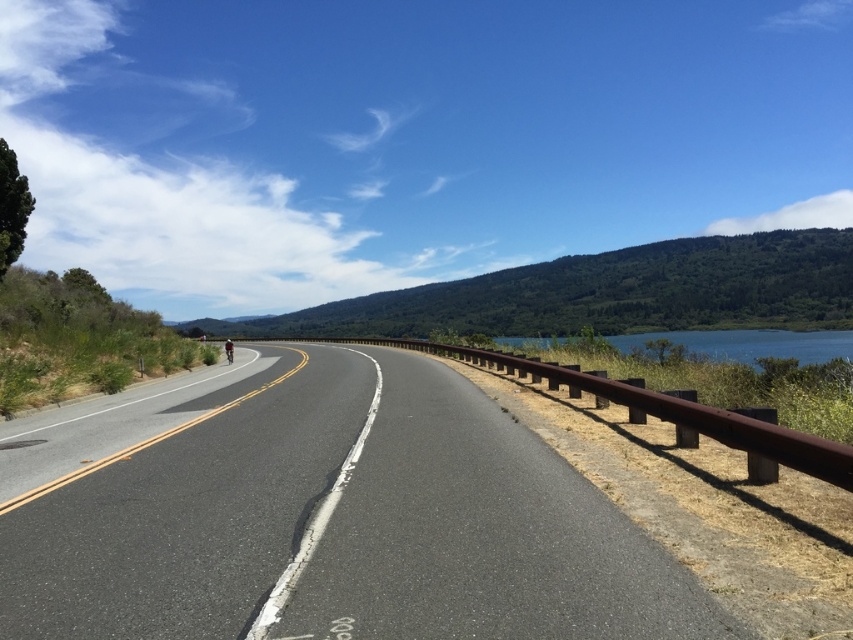
Does asphalt road at center come behind blue water at upper right?

That is False.

Is asphalt road at center above blue water at upper right?

No, asphalt road at center is not above blue water at upper right.

At what (x,y) coordinates should I click in order to perform the action: click on asphalt road at center. Please return your answer as a coordinate pair (x, y). This screenshot has width=853, height=640. Looking at the image, I should click on (315, 515).